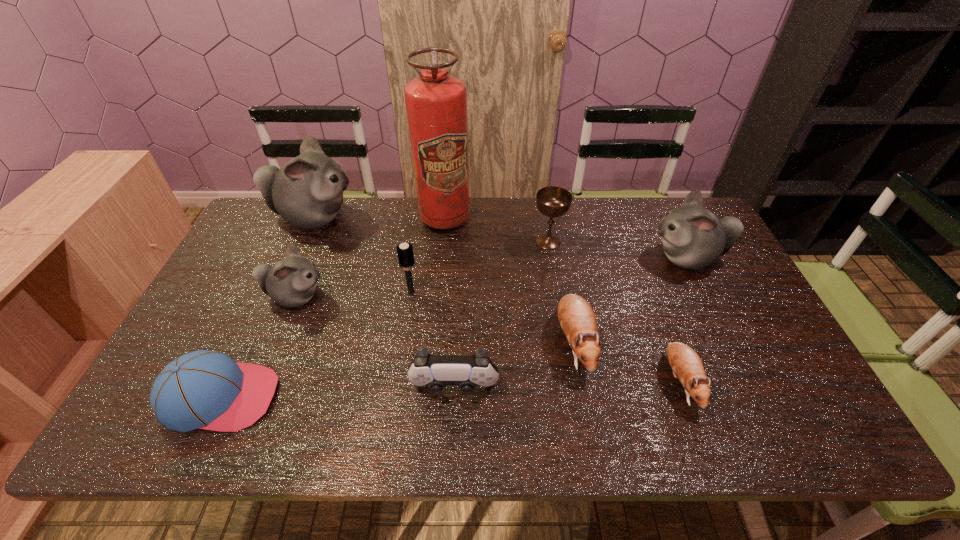
You are a GUI agent. You are given a task and a screenshot of the screen. Output one action in this format:
    pyautogui.click(x=<x>, y=<y>)
    Task: Click on the baseball cap at the near edge
    Image resolution: width=960 pixels, height=540 pixels.
    Given the screenshot: What is the action you would take?
    tap(203, 389)

Image resolution: width=960 pixels, height=540 pixels. Identify the location of hamster present at the near edge. click(686, 365).

Locate an element on the screen. The width and height of the screenshot is (960, 540). baseball cap located at the left edge is located at coordinates (203, 389).

You are a GUI agent. You are given a task and a screenshot of the screen. Output one action in this format:
    pyautogui.click(x=<x>, y=<y>)
    Task: Click on the object that is positioned at the right edge
    
    Given the screenshot: What is the action you would take?
    pyautogui.click(x=692, y=237)

Identify the location of object that is at the far left corner. (307, 192).

This screenshot has height=540, width=960. What are the coordinates of `object that is at the near left corner` in the screenshot? It's located at (203, 389).

Where is `object that is at the far right corner`? The width and height of the screenshot is (960, 540). object that is at the far right corner is located at coordinates (692, 237).

The height and width of the screenshot is (540, 960). What are the coordinates of `free space at the far edge` in the screenshot? It's located at (615, 218).

This screenshot has width=960, height=540. What are the coordinates of `vacant space at the near edge of the desktop` in the screenshot? It's located at [x=338, y=420].

You are a GUI agent. You are given a task and a screenshot of the screen. Output one action in this format:
    pyautogui.click(x=<x>, y=<y>)
    Task: Click on the vacant space at the right edge
    Image resolution: width=960 pixels, height=540 pixels.
    Given the screenshot: What is the action you would take?
    pyautogui.click(x=749, y=336)